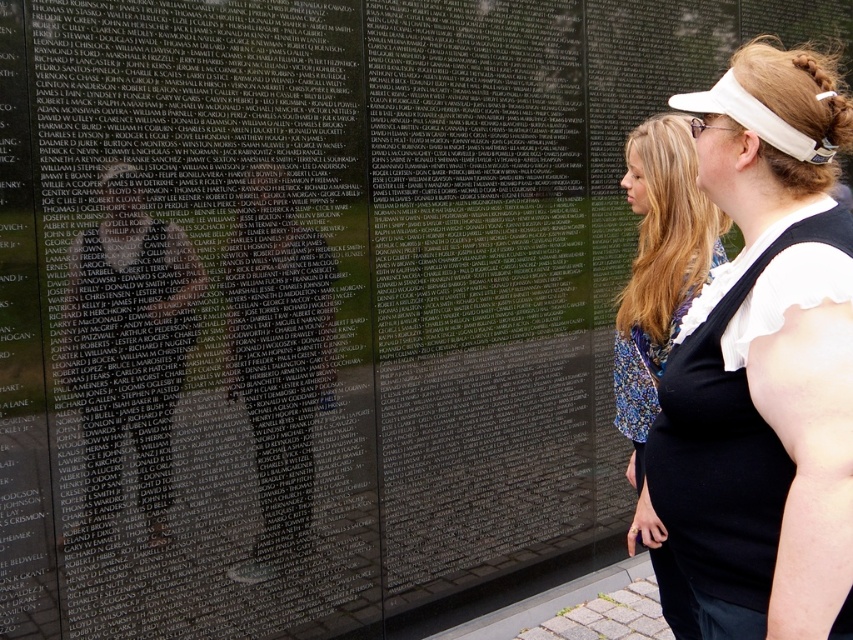
Question: Estimate the real-world distances between objects in this image. Which object is farther from the blonde hair at upper center?

Choices:
 (A) matte black dress at center
 (B) matte white visor at upper right

Answer: (A)

Question: Can you confirm if matte black dress at center is wider than blonde hair at upper center?

Choices:
 (A) no
 (B) yes

Answer: (A)

Question: Which point appears farthest from the camera in this image?

Choices:
 (A) (822, 100)
 (B) (654, 236)
 (C) (758, 628)

Answer: (B)

Question: Does matte black dress at center appear over blonde hair at upper center?

Choices:
 (A) no
 (B) yes

Answer: (A)

Question: Does matte white visor at upper right appear on the right side of blonde hair at upper center?

Choices:
 (A) no
 (B) yes

Answer: (A)

Question: Which point is closer to the camera?

Choices:
 (A) blonde hair at upper center
 (B) matte white visor at upper right

Answer: (B)